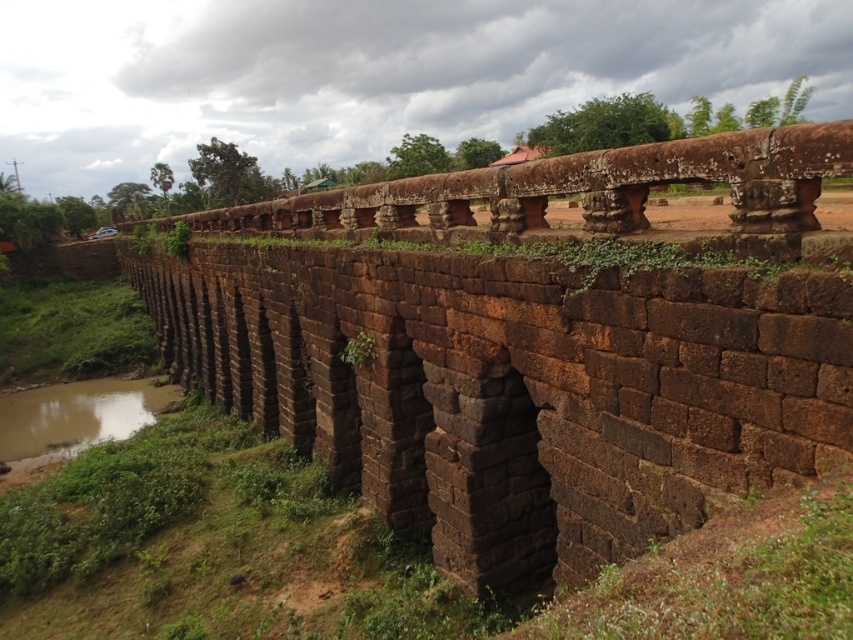
You are standing on a historical stone bridge with multiple arches. There is a point marked at coordinates (527, 348). Which object does this point correspond to?

The point at coordinates (527, 348) corresponds to the brown stone viaduct at center.

You are standing on the bank of the waterway and want to cross to the other side. The brown muddy water at lower left is flowing gently. Can you safely step onto the brown stone bridge at center from your current position on the bank?

The brown stone bridge at center is to the right of the brown muddy water at lower left, so you can safely step onto the brown stone bridge at center from the bank as it is positioned next to the water.